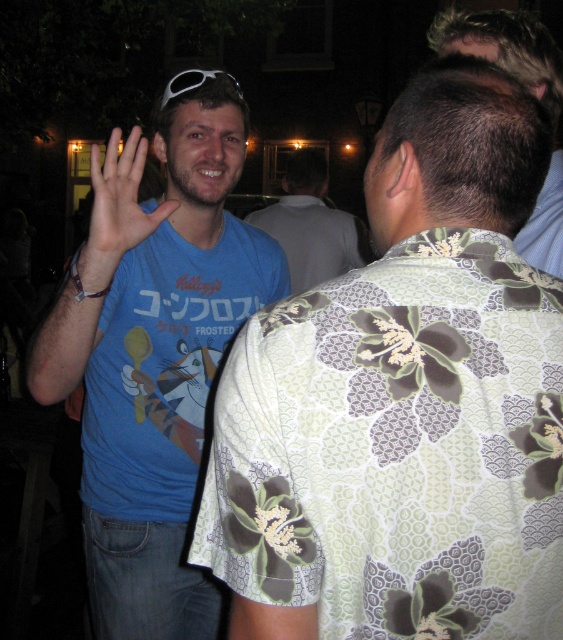
You are standing at the point with coordinates point (99, 157) and want to move to the point with coordinates point (310, 173). Given that you can only move forward in a straight line, will you be able to reach your destination without changing direction?

Yes, because point (310, 173) is behind point (99, 157), so moving forward in a straight line from point (99, 157) will lead you directly to point (310, 173).